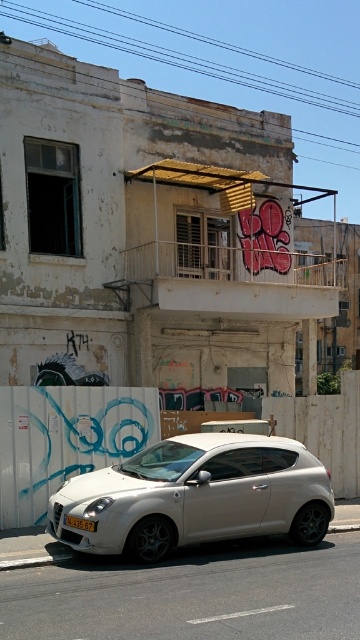
You are a delivery driver trying to park your vehicle in a tight space between two other cars. The space is only as wide as the yellow matte license plate at lower center. Can your white matte hatchback at center fit into this space?

The white matte hatchback at center might be wider than yellow matte license plate at lower center, so it may not fit into the space.

You are a photographer standing in the middle of the street. You want to take a photo of both the white Alfa Romeo sports car and the graffiti on the building. However, you notice that one of the points, either point (65, 502) or point (91, 524), is closer to you. Which point should you focus on to ensure both the car and the graffiti are in focus?

You should focus on point (65, 502) because it is closer to you than point (91, 524). By focusing on the closer point, the depth of field will likely include both the car and the graffiti in the scene.

You are a delivery driver who needs to park your vehicle in this urban area. The parking spot is located at point 0.777, 0.547. Is the white matte hatchback at center currently occupying that parking spot?

The white matte hatchback at center is positioned at point (196, 497), so yes, it is occupying the parking spot at that location.